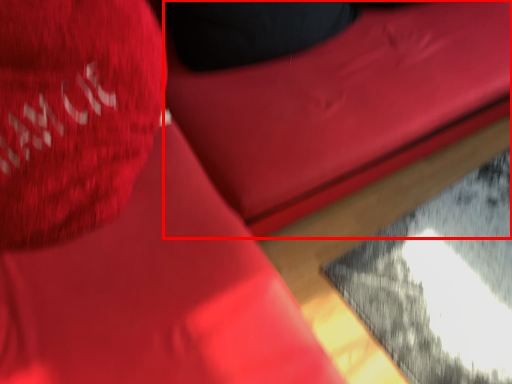
Question: In this image, where is bean bag chair (annotated by the red box) located relative to throw pillow?

Choices:
 (A) right
 (B) left

Answer: (A)